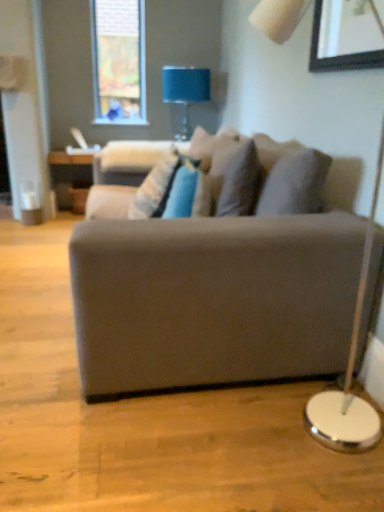
Question: Is point (132, 205) positioned closer to the camera than point (238, 367)?

Choices:
 (A) farther
 (B) closer

Answer: (A)

Question: Considering their positions, is textured beige pillow at center located in front of or behind suede gray couch at center?

Choices:
 (A) front
 (B) behind

Answer: (B)

Question: Which of these objects is positioned farthest from the wooden picture frame at upper right?

Choices:
 (A) textured beige pillow at center
 (B) suede gray couch at center
 (C) blue fabric lampshade at upper center
 (D) velvet beige swivel chair at center

Answer: (C)

Question: Which object is the closest to the wooden picture frame at upper right?

Choices:
 (A) suede gray couch at center
 (B) blue fabric lampshade at upper center
 (C) velvet beige swivel chair at center
 (D) textured beige pillow at center

Answer: (D)